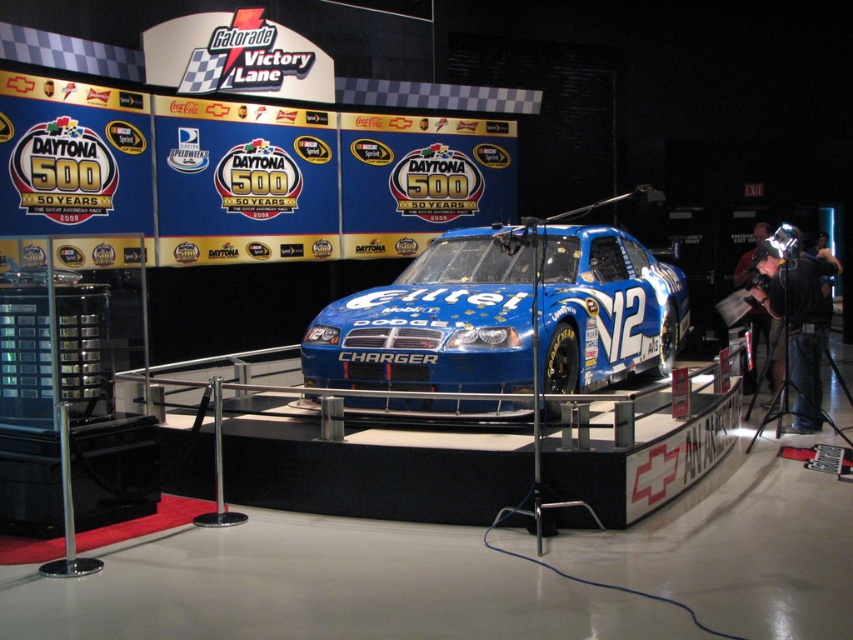
Question: Which point appears farthest from the camera in this image?

Choices:
 (A) (770, 372)
 (B) (828, 264)
 (C) (579, 378)

Answer: (A)

Question: Which point appears closest to the camera in this image?

Choices:
 (A) pos(529,388)
 (B) pos(746,273)

Answer: (A)

Question: Which object is farther from the camera taking this photo?

Choices:
 (A) blue glossy charger at center
 (B) black fabric camera at right
 (C) black leather jacket at right

Answer: (C)

Question: Can you confirm if blue glossy charger at center is smaller than black leather jacket at right?

Choices:
 (A) no
 (B) yes

Answer: (A)

Question: Does blue glossy charger at center have a lesser width compared to black leather jacket at right?

Choices:
 (A) yes
 (B) no

Answer: (B)

Question: Is the position of blue glossy charger at center less distant than that of black leather jacket at right?

Choices:
 (A) yes
 (B) no

Answer: (A)